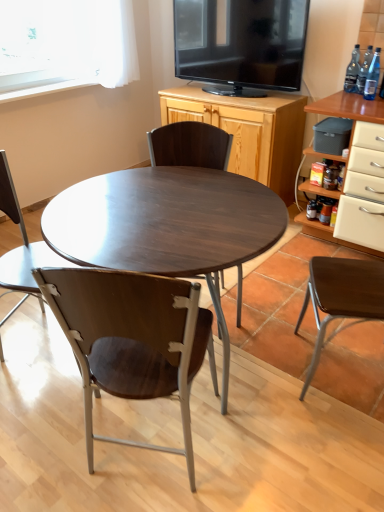
Question: Should I look upward or downward to see dark wood chair at center, positioned as the 3th chair in left-to-right order?

Choices:
 (A) up
 (B) down

Answer: (A)

Question: Is transparent glass bottle at upper right, placed as the second bottle when sorted from back to front, closer to the viewer compared to clear glass bottle at upper right, marked as the 3th bottle in a front-to-back arrangement?

Choices:
 (A) no
 (B) yes

Answer: (B)

Question: Can you confirm if transparent glass bottle at upper right, placed as the second bottle when sorted from back to front, is positioned to the left of clear glass bottle at upper right, the 1th bottle from the back?

Choices:
 (A) yes
 (B) no

Answer: (B)

Question: From the image's perspective, is transparent glass bottle at upper right, arranged as the 2th bottle when viewed from the front, under clear glass bottle at upper right, the 1th bottle from the back?

Choices:
 (A) no
 (B) yes

Answer: (B)

Question: Is transparent glass bottle at upper right, placed as the second bottle when sorted from back to front, far away from clear glass bottle at upper right, the 1th bottle from the back?

Choices:
 (A) no
 (B) yes

Answer: (A)

Question: Is transparent glass bottle at upper right, arranged as the 2th bottle when viewed from the front, thinner than clear glass bottle at upper right, the 1th bottle from the back?

Choices:
 (A) no
 (B) yes

Answer: (B)

Question: Does transparent glass bottle at upper right, arranged as the 2th bottle when viewed from the front, have a larger size compared to clear glass bottle at upper right, marked as the 3th bottle in a front-to-back arrangement?

Choices:
 (A) no
 (B) yes

Answer: (A)

Question: Is wooden chair at center, the 3th chair viewed from the right, facing towards blue glass bottle at upper right, arranged as the first bottle when viewed from the front?

Choices:
 (A) yes
 (B) no

Answer: (B)

Question: Does wooden chair at center, positioned as the 2th chair in left-to-right order, have a lesser height compared to blue glass bottle at upper right, the 3th bottle positioned from the back?

Choices:
 (A) no
 (B) yes

Answer: (A)

Question: Is wooden chair at center, positioned as the 2th chair in left-to-right order, at the right side of blue glass bottle at upper right, arranged as the first bottle when viewed from the front?

Choices:
 (A) yes
 (B) no

Answer: (B)

Question: Is wooden chair at center, the 3th chair viewed from the right, wider than blue glass bottle at upper right, the 3th bottle positioned from the back?

Choices:
 (A) yes
 (B) no

Answer: (A)

Question: Is wooden chair at center, the 3th chair viewed from the right, not within blue glass bottle at upper right, the 3th bottle positioned from the back?

Choices:
 (A) no
 (B) yes

Answer: (B)

Question: From a real-world perspective, is wooden chair at center, the 3th chair viewed from the right, positioned over blue glass bottle at upper right, the 3th bottle positioned from the back, based on gravity?

Choices:
 (A) yes
 (B) no

Answer: (B)

Question: From the image's perspective, does clear glass bottle at upper right, marked as the 3th bottle in a front-to-back arrangement, appear higher than brown wood chair at right, acting as the fourth chair starting from the left?

Choices:
 (A) yes
 (B) no

Answer: (A)